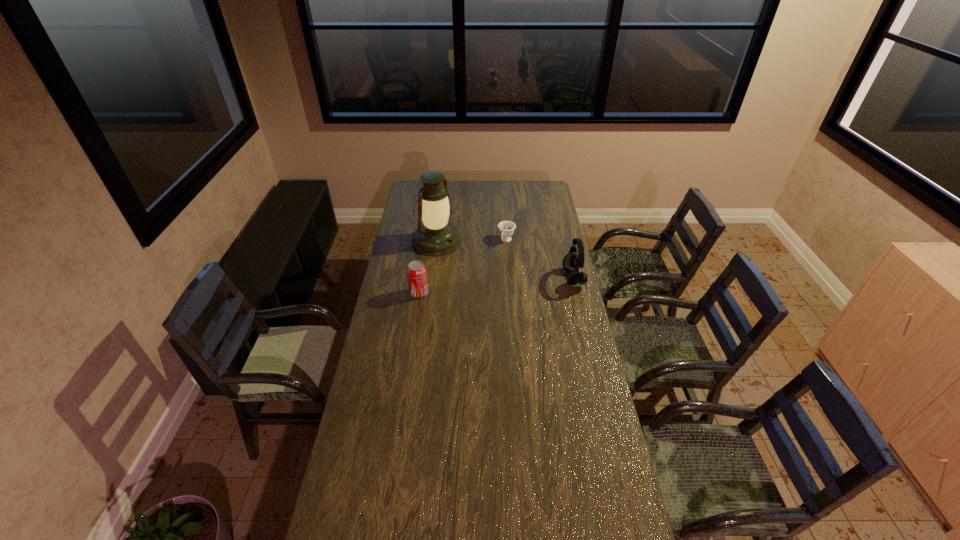
The width and height of the screenshot is (960, 540). In order to click on free location located on the ear cups of the third shortest object in this screenshot , I will do pos(548,279).

Identify the location of vacant region located on the ear cups of the third shortest object. (519, 279).

This screenshot has height=540, width=960. I want to click on vacant space located on the side of the shortest object with the handle, so coord(475,291).

Find the location of a particular element. blank area located 0.140m on the side of the shortest object with the handle is located at coordinates (493, 262).

Find the location of a particular element. Image resolution: width=960 pixels, height=540 pixels. vacant space located on the side of the shortest object with the handle is located at coordinates (493, 262).

Identify the location of vacant space located with the light compartment facing forward on the lantern. (493, 271).

You are a GUI agent. You are given a task and a screenshot of the screen. Output one action in this format:
    pyautogui.click(x=<x>, y=<y>)
    Task: Click on the vacant region located with the light compartment facing forward on the lantern
    
    Given the screenshot: What is the action you would take?
    pyautogui.click(x=476, y=261)

Find the location of a particular element. free space located 0.120m with the light compartment facing forward on the lantern is located at coordinates (473, 260).

This screenshot has width=960, height=540. What are the coordinates of `soda can that is at the left edge` in the screenshot? It's located at (417, 275).

You are a GUI agent. You are given a task and a screenshot of the screen. Output one action in this format:
    pyautogui.click(x=<x>, y=<y>)
    Task: Click on the lantern located at the left edge
    
    Given the screenshot: What is the action you would take?
    pyautogui.click(x=436, y=237)